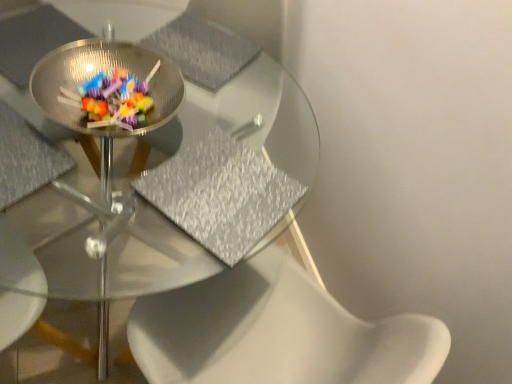
Locate an element on the screen. Image resolution: width=512 pixels, height=384 pixels. metallic silver chair at center is located at coordinates (26, 158).

In the image, is clear glass bowl at center on the left side or the right side of transparent glass table at center?

From the image, it's evident that clear glass bowl at center is to the right of transparent glass table at center.

In order to click on glass plate on the right of transparent glass table at center in this screenshot , I will do `click(108, 71)`.

Can you tell me how much clear glass bowl at center and transparent glass table at center differ in facing direction?

There is a 1.8-degree angle between the facing directions of clear glass bowl at center and transparent glass table at center.

Does clear glass bowl at center have a greater height compared to transparent glass table at center?

Incorrect, the height of clear glass bowl at center is not larger of that of transparent glass table at center.

From the image's perspective, is metallic silver chair at center located beneath transparent glass table at center?

No, from the image's perspective, metallic silver chair at center is not beneath transparent glass table at center.

From a real-world perspective, is metallic silver chair at center physically above transparent glass table at center?

Indeed, from a real-world perspective, metallic silver chair at center stands above transparent glass table at center.

Would you say metallic silver chair at center is a long distance from transparent glass table at center?

No, there isn't a large distance between metallic silver chair at center and transparent glass table at center.

Would you say metallic silver chair at center contains transparent glass table at center?

That's incorrect, transparent glass table at center is not inside metallic silver chair at center.

Is transparent glass table at center next to clear glass bowl at center and touching it?

No, transparent glass table at center is not with clear glass bowl at center.

Is clear glass bowl at center surrounded by transparent glass table at center?

No, clear glass bowl at center is located outside of transparent glass table at center.

Which of these two, transparent glass table at center or clear glass bowl at center, is smaller?

clear glass bowl at center is smaller.

What's the angular difference between transparent glass table at center and clear glass bowl at center's facing directions?

They differ by 1.8 degrees in their facing directions.

Is point (47, 187) closer to viewer compared to point (21, 194)?

No, (47, 187) is further to viewer.

Is transparent glass table at center facing towards metallic silver chair at center?

No, transparent glass table at center is not turned towards metallic silver chair at center.

Is transparent glass table at center taller or shorter than metallic silver chair at center?

Considering their sizes, transparent glass table at center has more height than metallic silver chair at center.

Between transparent glass table at center and metallic silver chair at center, which one appears on the left side from the viewer's perspective?

metallic silver chair at center.

Between metallic silver chair at center and clear glass bowl at center, which one has smaller size?

With smaller size is metallic silver chair at center.

From a real-world perspective, which is physically below, metallic silver chair at center or clear glass bowl at center?

metallic silver chair at center.

Is metallic silver chair at center next to clear glass bowl at center and touching it?

No, metallic silver chair at center is not making contact with clear glass bowl at center.

Consider the image. Can you confirm if clear glass bowl at center is shorter than metallic silver chair at center?

In fact, clear glass bowl at center may be taller than metallic silver chair at center.

Considering the positions of point (42, 85) and point (4, 195), is point (42, 85) closer or farther from the camera than point (4, 195)?

Point (42, 85) is farther from the camera than point (4, 195).

Would you consider clear glass bowl at center to be distant from metallic silver chair at center?

They are positioned close to each other.

Between clear glass bowl at center and metallic silver chair at center, which one has smaller size?

Smaller between the two is metallic silver chair at center.

Where is `glass plate above the transparent glass table at center (from a real-world perspective)`? glass plate above the transparent glass table at center (from a real-world perspective) is located at coordinates (108, 71).

Where is `chair above the transparent glass table at center (from the image's perspective)`? The height and width of the screenshot is (384, 512). chair above the transparent glass table at center (from the image's perspective) is located at coordinates (26, 158).

Which object lies nearer to the anchor point metallic silver chair at center, clear glass bowl at center or transparent glass table at center?

The object closer to metallic silver chair at center is clear glass bowl at center.

From the image, which object appears to be farther from clear glass bowl at center, transparent glass table at center or metallic silver chair at center?

transparent glass table at center.

From the image, which object appears to be nearer to transparent glass table at center, clear glass bowl at center or metallic silver chair at center?

The object closer to transparent glass table at center is clear glass bowl at center.

Based on their spatial positions, is metallic silver chair at center or transparent glass table at center further from clear glass bowl at center?

transparent glass table at center is further to clear glass bowl at center.

Estimate the real-world distances between objects in this image. Which object is closer to metallic silver chair at center, transparent glass table at center or clear glass bowl at center?

clear glass bowl at center lies closer to metallic silver chair at center than the other object.

From the image, which object appears to be nearer to transparent glass table at center, metallic silver chair at center or clear glass bowl at center?

The object closer to transparent glass table at center is clear glass bowl at center.

This screenshot has width=512, height=384. Identify the location of chair between clear glass bowl at center and transparent glass table at center from top to bottom. (26, 158).